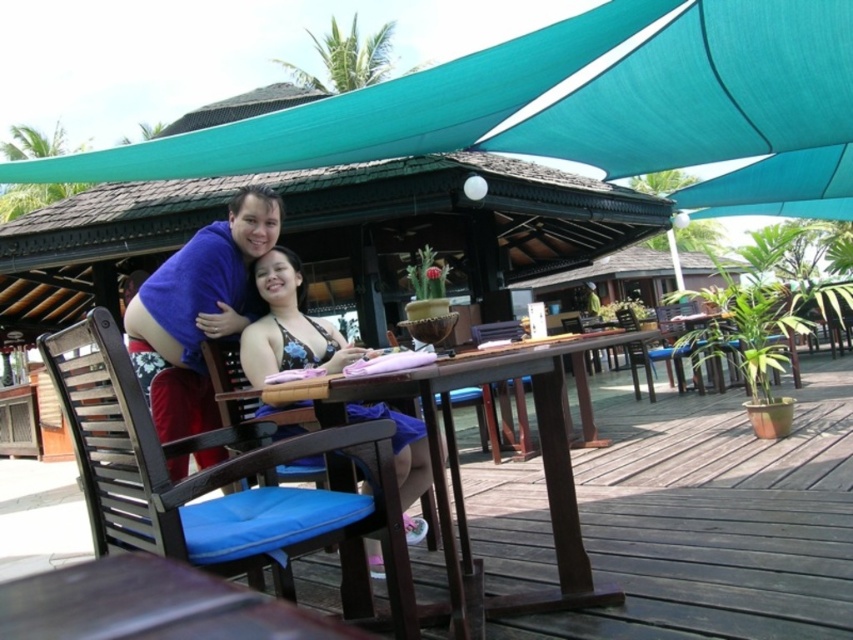
Is brown wooden table at center below black floral bikini at center?

Yes.

Does point (463, 378) come in front of point (270, 307)?

Yes, point (463, 378) is in front of point (270, 307).

Locate an element on the screen. The image size is (853, 640). brown wooden table at center is located at coordinates (x=459, y=477).

Does teal fabric canopy at upper center appear over brown wooden table at center?

Yes, teal fabric canopy at upper center is above brown wooden table at center.

Looking at this image, who is taller, teal fabric canopy at upper center or brown wooden table at center?

brown wooden table at center

This screenshot has height=640, width=853. I want to click on teal fabric canopy at upper center, so click(566, 99).

You are a GUI agent. You are given a task and a screenshot of the screen. Output one action in this format:
    pyautogui.click(x=<x>, y=<y>)
    Task: Click on the teal fabric canopy at upper center
    The height and width of the screenshot is (640, 853).
    Given the screenshot: What is the action you would take?
    pyautogui.click(x=566, y=99)

Does blue padded chair at center have a smaller size compared to brown wooden table at center?

Yes, blue padded chair at center is smaller than brown wooden table at center.

Does blue padded chair at center come in front of brown wooden table at center?

That is True.

Is point (286, 444) closer to viewer compared to point (300, 388)?

Yes, it is in front of point (300, 388).

The height and width of the screenshot is (640, 853). I want to click on blue padded chair at center, so click(x=201, y=472).